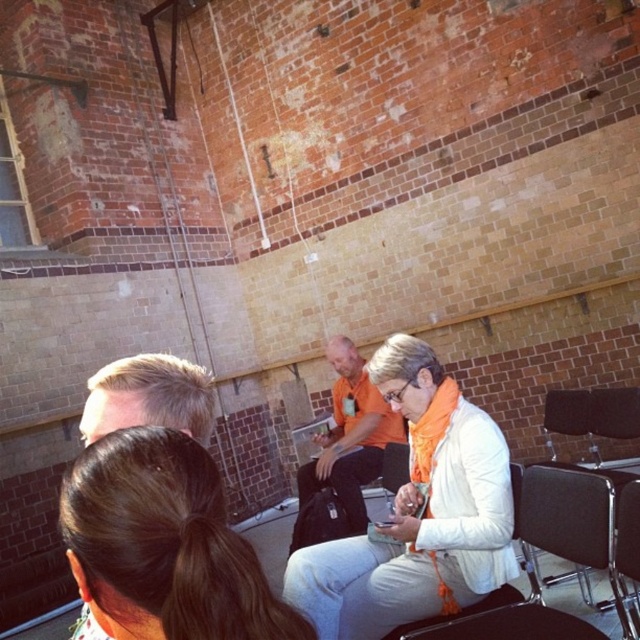
You are sitting in a chair at the back of the room and want to see the person wearing the orange cotton shirt at center. Is the black leather chair at center blocking your view?

The black leather chair at center is behind the orange cotton shirt at center, so it is not blocking your view. You can see the orange cotton shirt at center without any obstruction.

You are organizing a photo shoot and need to ensure that the orange cotton shirt at center and the brown hair at center are framed properly. Based on their sizes, which object should you prioritize positioning closer to the camera to maintain visual balance?

The orange cotton shirt at center should be positioned closer to the camera because its width surpasses that of the brown hair at center, ensuring visual balance by compensating for its larger size.

You are standing at the origin of the coordinate system in the image. You want to move towards the point at the center of the room. Which point should you head towards, point at (426, 384) or point at (337, 486)?

Point at (426, 384) is in front of point at (337, 486), so you should head towards point at (426, 384) to reach the center of the room first.